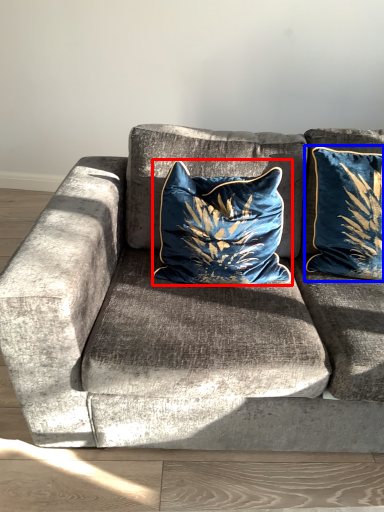
Question: Which point is closer to the camera, pillow (highlighted by a red box) or pillow (highlighted by a blue box)?

Choices:
 (A) pillow
 (B) pillow

Answer: (A)